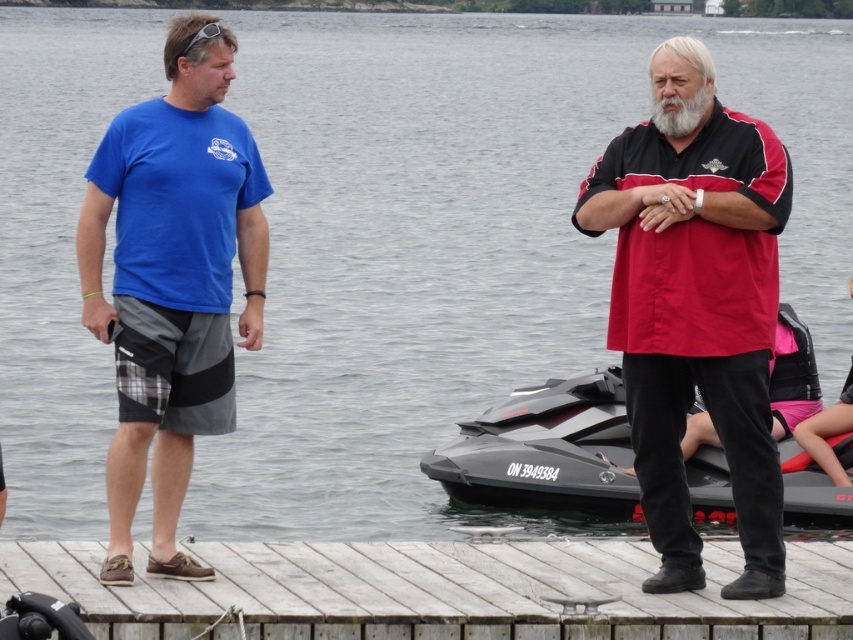
Does point (761, 529) come closer to viewer compared to point (608, 480)?

Yes, it is.

In the scene shown: Can you confirm if red/black shirt at center is thinner than black matte jet ski at lower center?

In fact, red/black shirt at center might be wider than black matte jet ski at lower center.

You are a GUI agent. You are given a task and a screenshot of the screen. Output one action in this format:
    pyautogui.click(x=<x>, y=<y>)
    Task: Click on the red/black shirt at center
    The image size is (853, 640).
    Given the screenshot: What is the action you would take?
    pyautogui.click(x=697, y=323)

Find the location of a particular element. This screenshot has height=640, width=853. red/black shirt at center is located at coordinates (697, 323).

Is point (660, 490) in front of point (126, 250)?

Yes, point (660, 490) is in front of point (126, 250).

Does red/black shirt at center have a lesser height compared to blue fabric shirt at left?

Correct, red/black shirt at center is not as tall as blue fabric shirt at left.

Does point (775, 579) lie in front of point (107, 502)?

Yes, it is in front of point (107, 502).

Find the location of a particular element. This screenshot has width=853, height=640. red/black shirt at center is located at coordinates (697, 323).

Can you confirm if red/black shirt at center is thinner than graywoollybeard at right?

Incorrect, red/black shirt at center's width is not less than graywoollybeard at right's.

Is red/black shirt at center positioned behind graywoollybeard at right?

That is False.

You are a GUI agent. You are given a task and a screenshot of the screen. Output one action in this format:
    pyautogui.click(x=<x>, y=<y>)
    Task: Click on the red/black shirt at center
    This screenshot has width=853, height=640.
    Given the screenshot: What is the action you would take?
    pyautogui.click(x=697, y=323)